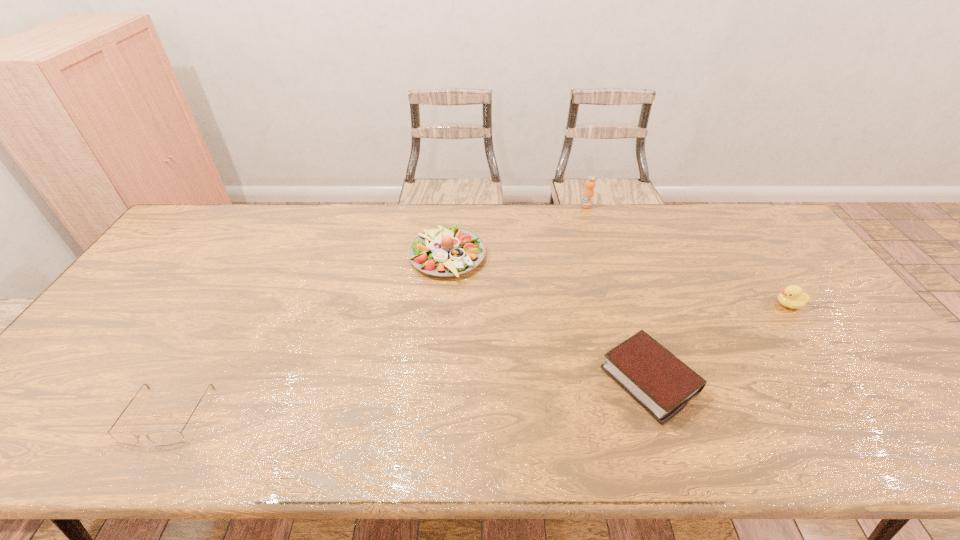
Locate an element on the screen. vacant area that lies between the leftmost object and the Bible is located at coordinates (408, 397).

The image size is (960, 540). What are the coordinates of `unoccupied area between the Bible and the third farthest object` in the screenshot? It's located at (719, 342).

Identify the location of free spot between the farthest object and the third nearest object. (687, 255).

Identify the location of empty space between the salad plate and the tallest object. Image resolution: width=960 pixels, height=540 pixels. (516, 231).

This screenshot has width=960, height=540. I want to click on object that is the second closest to the duckling, so click(588, 194).

Point out which object is positioned as the third nearest to the second farthest object. Please provide its 2D coordinates. Your answer should be formatted as a tuple, i.e. [(x, y)], where the tuple contains the x and y coordinates of a point satisfying the conditions above.

[(167, 437)]

Where is `vacant space that satisfies the following two spatial constraints: 1. on the beak of the duckling; 2. on the front side of the Bible`? Image resolution: width=960 pixels, height=540 pixels. vacant space that satisfies the following two spatial constraints: 1. on the beak of the duckling; 2. on the front side of the Bible is located at coordinates (842, 380).